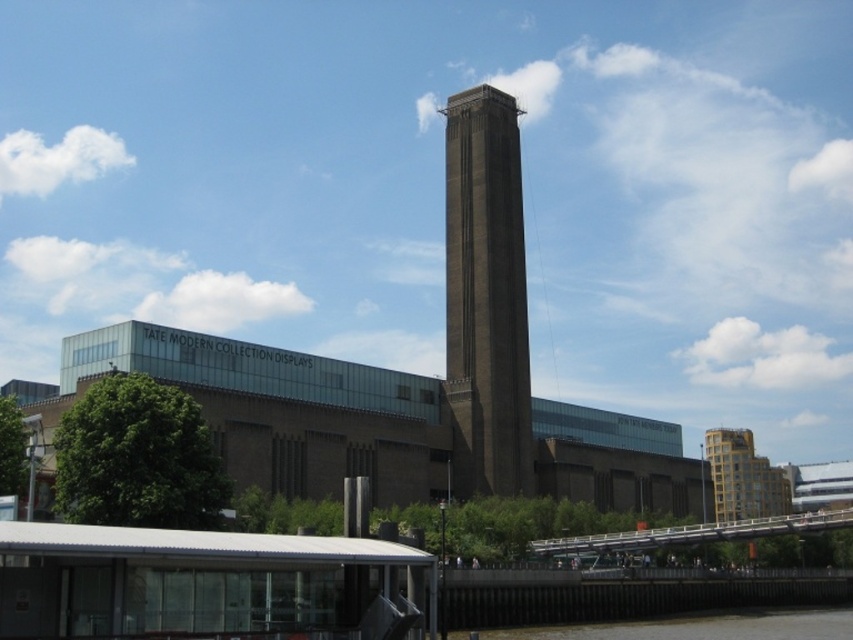
Question: Is brown stone tower at center bigger than brown concrete river at lower center?

Choices:
 (A) no
 (B) yes

Answer: (B)

Question: Is brown stone tower at center positioned at the back of brown concrete river at lower center?

Choices:
 (A) yes
 (B) no

Answer: (A)

Question: Among these objects, which one is farthest from the camera?

Choices:
 (A) brown concrete river at lower center
 (B) brown stone tower at center

Answer: (B)

Question: Which point is closer to the camera?

Choices:
 (A) (450, 230)
 (B) (680, 624)

Answer: (B)

Question: Can you confirm if brown stone tower at center is thinner than brown concrete river at lower center?

Choices:
 (A) no
 (B) yes

Answer: (B)